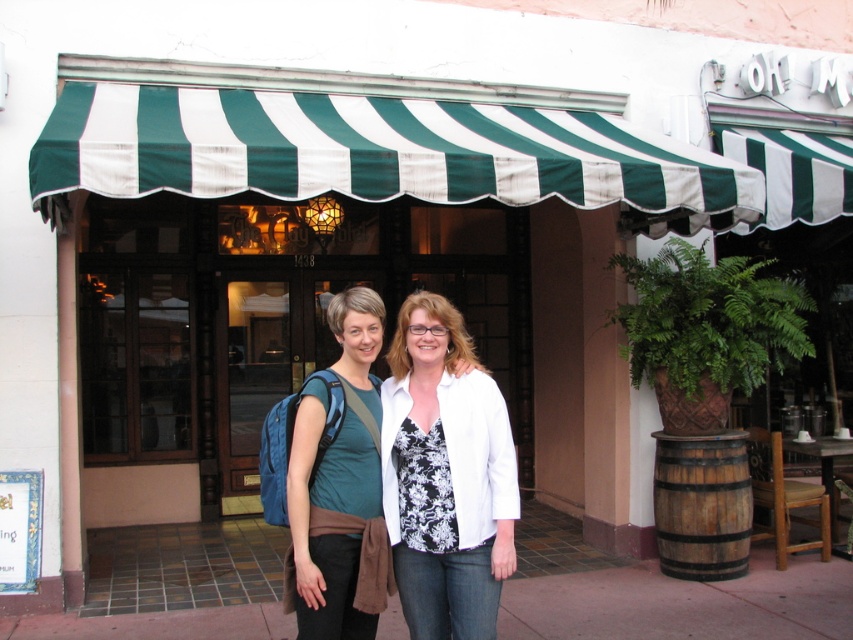
Question: Which point is closer to the camera?

Choices:
 (A) (525, 541)
 (B) (363, 307)
 (C) (274, 118)
 (D) (410, 474)

Answer: (B)

Question: Can you confirm if green striped awning at upper center is positioned above paved concrete sidewalk at center?

Choices:
 (A) yes
 (B) no

Answer: (A)

Question: Which point is closer to the camera taking this photo?

Choices:
 (A) (138, 577)
 (B) (311, 522)
 (C) (440, 147)

Answer: (B)

Question: Does paved concrete sidewalk at center appear on the left side of white matte jacket at center?

Choices:
 (A) yes
 (B) no

Answer: (B)

Question: Where is green striped awning at upper center located in relation to paved concrete sidewalk at center in the image?

Choices:
 (A) left
 (B) right

Answer: (A)

Question: Which of the following is the closest to the observer?

Choices:
 (A) (659, 168)
 (B) (633, 572)

Answer: (A)